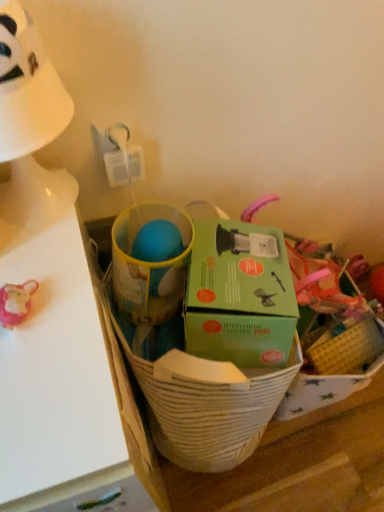
Where is `vacant space in front of white plastic table lamp at upper left`? The image size is (384, 512). vacant space in front of white plastic table lamp at upper left is located at coordinates (51, 282).